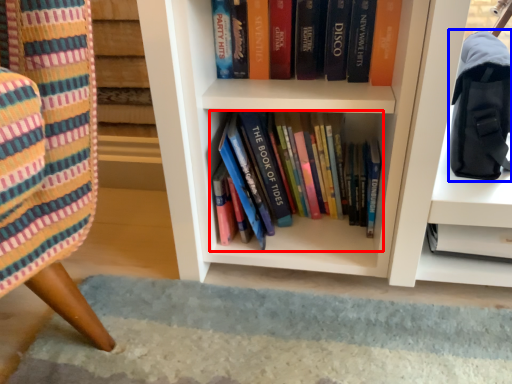
Question: Which point is further to the camera, book (highlighted by a red box) or shoulder bag (highlighted by a blue box)?

Choices:
 (A) book
 (B) shoulder bag

Answer: (A)